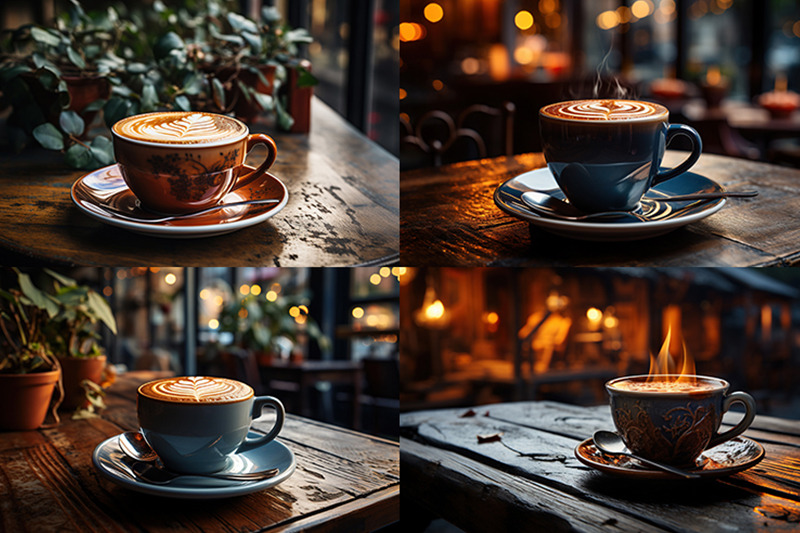
Find the location of a particular element. spoons is located at coordinates (610, 446), (141, 450), (152, 471), (137, 213), (553, 201).